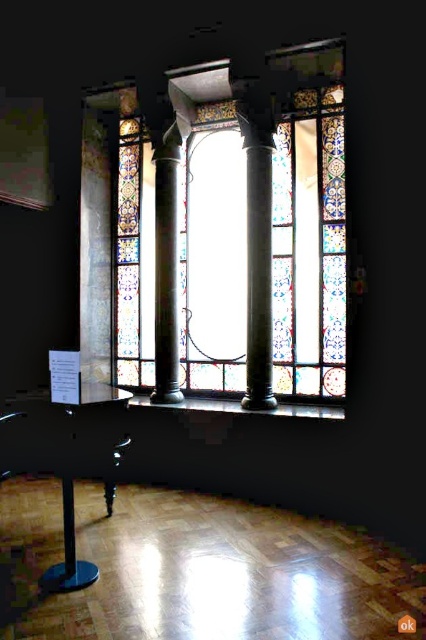
Is polished marble column at center taller than black plastic stool at lower left?

Yes, polished marble column at center is taller than black plastic stool at lower left.

Who is shorter, polished marble column at center or black plastic stool at lower left?

black plastic stool at lower left

Where is `polished marble column at center`? Image resolution: width=426 pixels, height=640 pixels. polished marble column at center is located at coordinates (258, 256).

At what (x,y) coordinates should I click in order to perform the action: click on polished marble column at center. Please return your answer as a coordinate pair (x, y). The image size is (426, 640). Looking at the image, I should click on (258, 256).

Looking at this image, is polished marble column at center closer to camera compared to polished dark green column at center?

Yes.

Measure the distance between point (258, 252) and camera.

A distance of 5.75 meters exists between point (258, 252) and camera.

Locate an element on the screen. The height and width of the screenshot is (640, 426). polished marble column at center is located at coordinates (258, 256).

This screenshot has width=426, height=640. Identify the location of polished marble column at center. [258, 256].

Is polished dark green column at center thinner than black plastic stool at lower left?

Yes.

This screenshot has height=640, width=426. What do you see at coordinates (166, 268) in the screenshot?
I see `polished dark green column at center` at bounding box center [166, 268].

You are a GUI agent. You are given a task and a screenshot of the screen. Output one action in this format:
    pyautogui.click(x=<x>, y=<y>)
    Task: Click on the polished dark green column at center
    
    Given the screenshot: What is the action you would take?
    pyautogui.click(x=166, y=268)